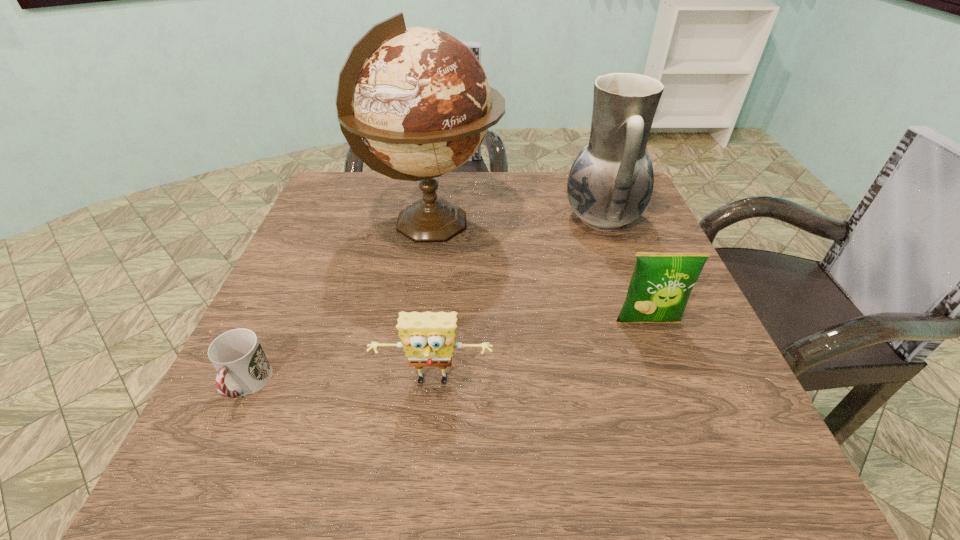
Find the location of a particular element. Image resolution: width=960 pixels, height=540 pixels. globe is located at coordinates (419, 98).

The width and height of the screenshot is (960, 540). Find the location of `pitcher`. pitcher is located at coordinates (610, 184).

Identify the location of the third tallest object. (661, 283).

The image size is (960, 540). I want to click on crisp (potato chip), so click(661, 283).

I want to click on the fourth tallest object, so click(428, 338).

This screenshot has width=960, height=540. I want to click on the leftmost object, so click(237, 355).

You are a GUI agent. You are given a task and a screenshot of the screen. Output one action in this format:
    pyautogui.click(x=<x>, y=<y>)
    Task: Click on the shortest object
    Image resolution: width=960 pixels, height=540 pixels.
    Given the screenshot: What is the action you would take?
    pyautogui.click(x=237, y=355)

Where is `vacant area situated 0.280m on the front of the tallest object showing Asia`? The width and height of the screenshot is (960, 540). vacant area situated 0.280m on the front of the tallest object showing Asia is located at coordinates (615, 224).

Find the location of `vacant space located on the front-facing side of the pitcher`. vacant space located on the front-facing side of the pitcher is located at coordinates (494, 218).

Where is `blank space located on the front-facing side of the pitcher`? blank space located on the front-facing side of the pitcher is located at coordinates (411, 218).